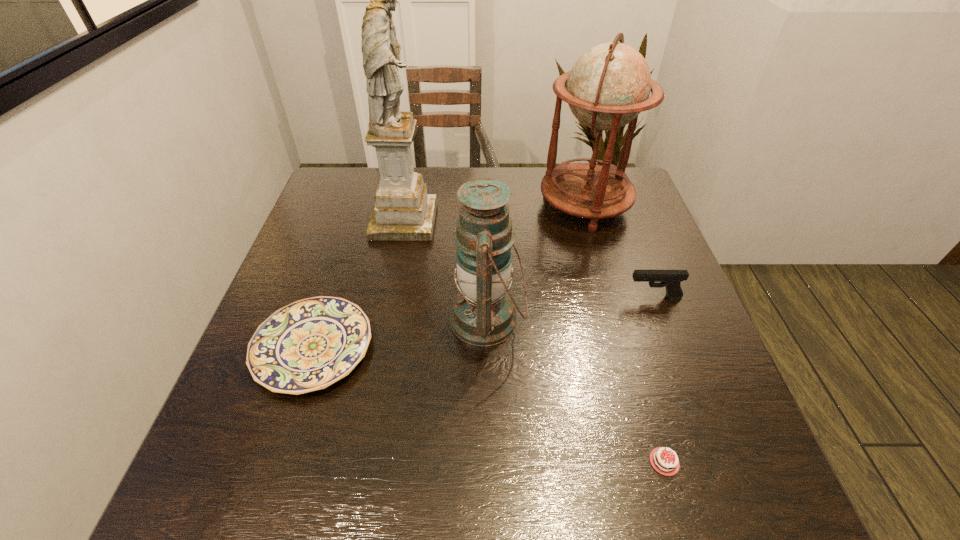
Image resolution: width=960 pixels, height=540 pixels. Identify the location of the tallest object. (403, 211).

Image resolution: width=960 pixels, height=540 pixels. Identify the location of the second tallest object. (609, 85).

Locate an element on the screen. This screenshot has height=540, width=960. oil lamp is located at coordinates (483, 314).

This screenshot has height=540, width=960. In order to click on the third tallest object in this screenshot , I will do `click(483, 314)`.

This screenshot has width=960, height=540. Find the location of `the fourth tallest object`. the fourth tallest object is located at coordinates (670, 279).

Identify the location of plate. The width and height of the screenshot is (960, 540). (308, 345).

Where is `chocolate cake`? Image resolution: width=960 pixels, height=540 pixels. chocolate cake is located at coordinates (660, 458).

Find the location of a particular element. vacant space situated 0.150m on the front-facing side of the sculpture is located at coordinates (489, 221).

Where is `free space located 0.370m on the surface of the globe`? Image resolution: width=960 pixels, height=540 pixels. free space located 0.370m on the surface of the globe is located at coordinates (412, 206).

Find the location of a particular element. This screenshot has height=540, width=960. vacant region located on the surface of the globe is located at coordinates (468, 206).